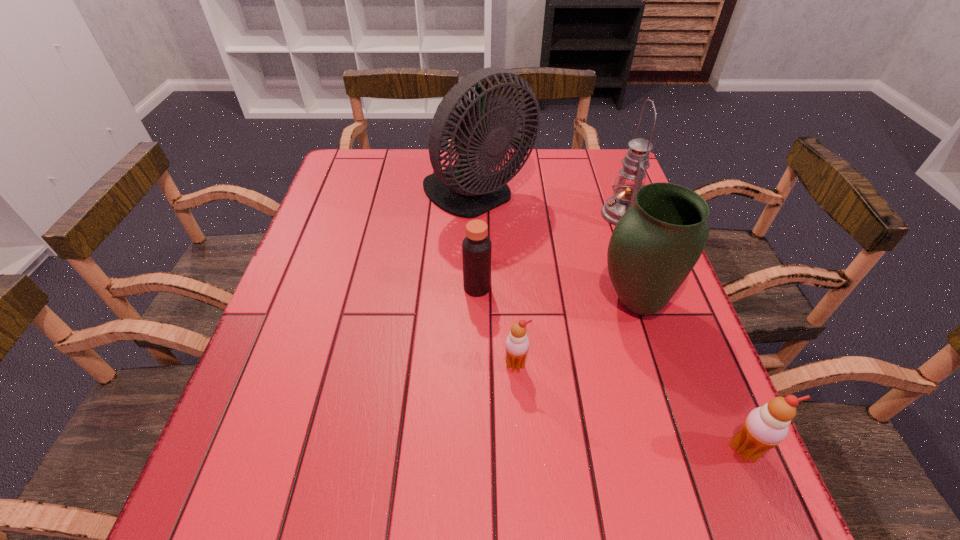
Image resolution: width=960 pixels, height=540 pixels. I want to click on the shorter icecream, so click(517, 343).

Identify the location of the left icecream. (517, 343).

At what (x,y) coordinates should I click in order to perform the action: click on the nearest object. Please return your answer as a coordinate pair (x, y). Image resolution: width=960 pixels, height=540 pixels. Looking at the image, I should click on (765, 427).

Find the location of `the nearer icecream`. the nearer icecream is located at coordinates (765, 427).

Locate an element on the screen. The image size is (960, 540). fan is located at coordinates (468, 189).

Locate an element on the screen. The width and height of the screenshot is (960, 540). vase is located at coordinates (654, 246).

Image resolution: width=960 pixels, height=540 pixels. I want to click on oil lamp, so click(631, 177).

Where is `vinegar`? This screenshot has width=960, height=540. vinegar is located at coordinates (476, 247).

Identify the location of free region located 0.120m at the front with a straw on the shortest object. The width and height of the screenshot is (960, 540). (519, 435).

The width and height of the screenshot is (960, 540). I want to click on vacant space situated in front of the fan to direct airflow, so click(476, 285).